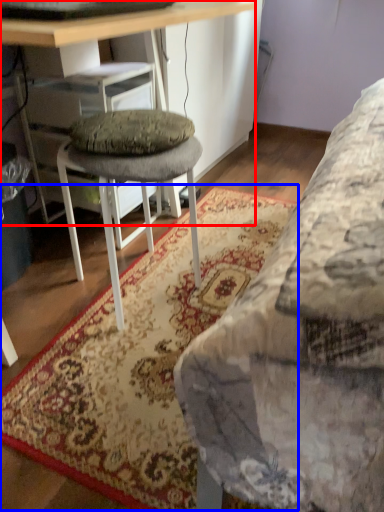
Question: Which object is closer to the camera taking this photo, desk (highlighted by a red box) or mat (highlighted by a blue box)?

Choices:
 (A) desk
 (B) mat

Answer: (A)